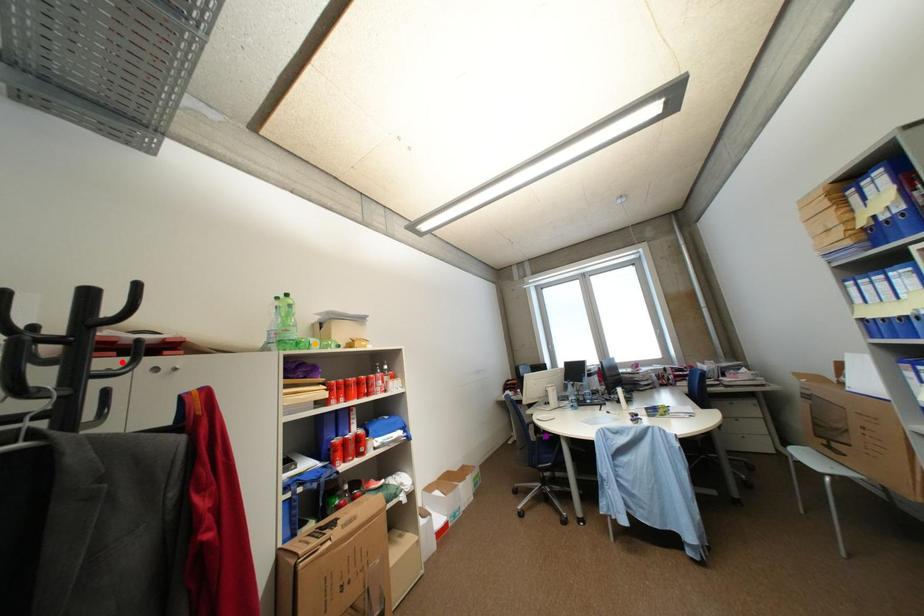
Order these from nearest to farthest:
- purple point
- orange point
- red point

purple point, orange point, red point